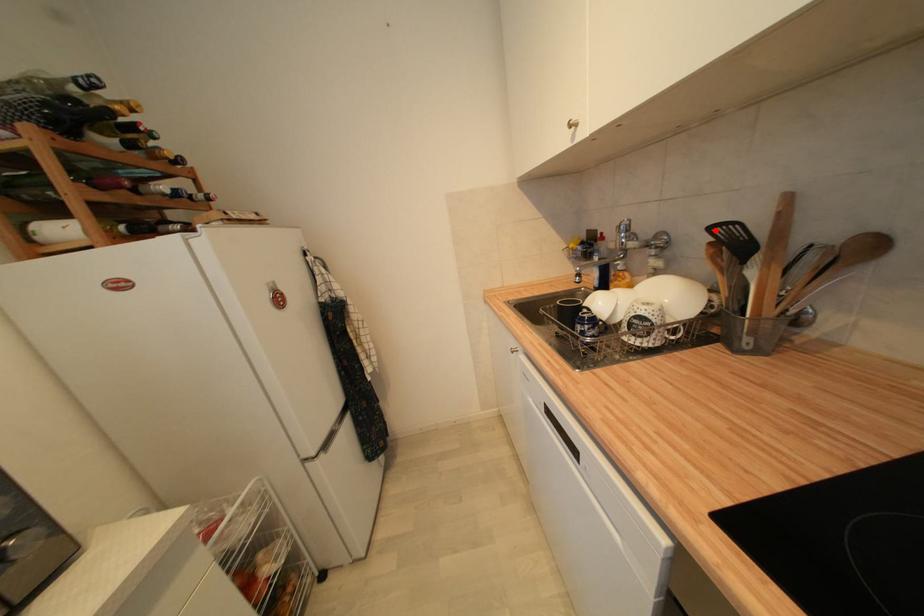
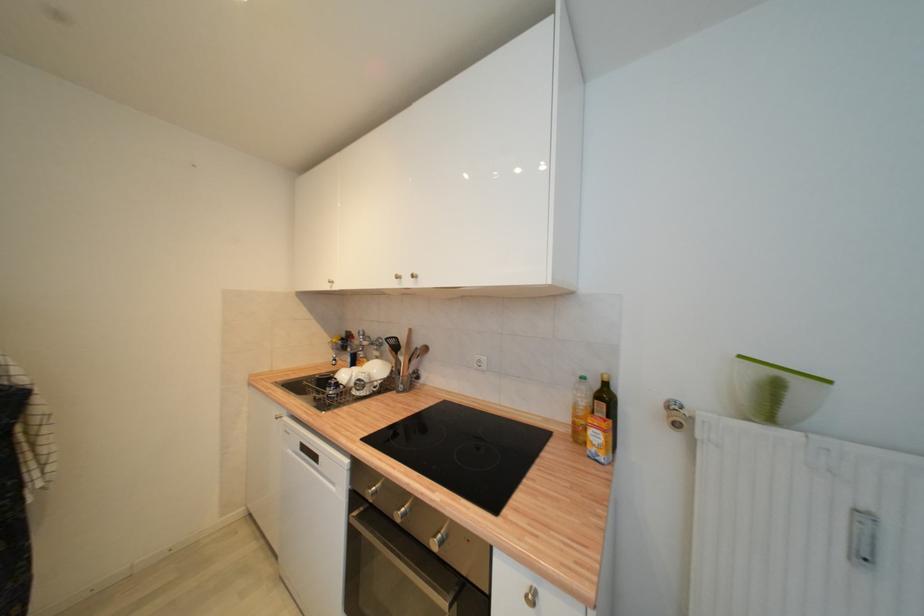
The point at the highlighted location is marked in the first image. Where is the corresponding point in the second image?

(392, 341)